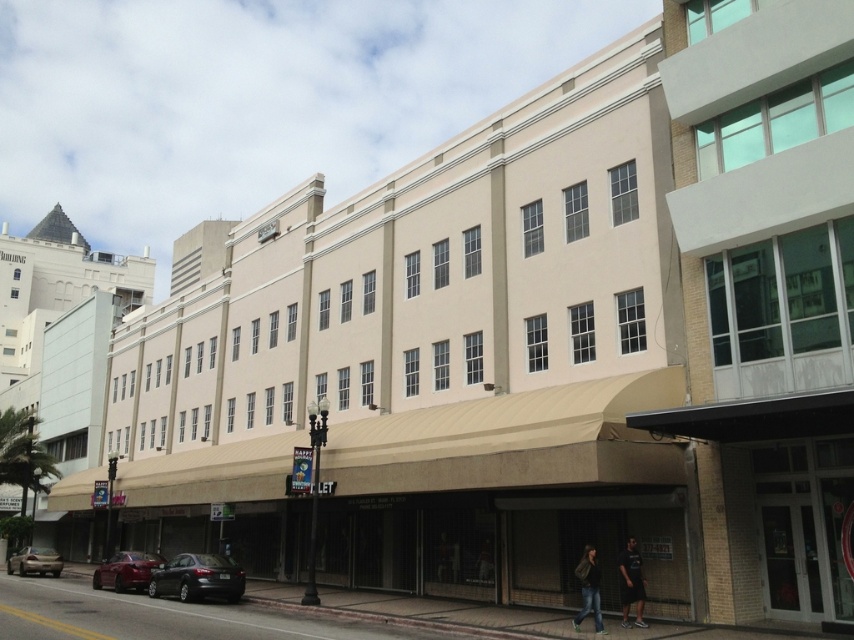
Question: Which object is the closest to the matte silver sedan at lower left?

Choices:
 (A) dark gray t-shirt at lower right
 (B) green fabric jacket at lower center
 (C) shiny red sedan at lower left

Answer: (C)

Question: Does green fabric jacket at lower center appear over matte silver sedan at lower left?

Choices:
 (A) yes
 (B) no

Answer: (A)

Question: Considering the real-world distances, which object is closest to the green fabric jacket at lower center?

Choices:
 (A) dark gray t-shirt at lower right
 (B) shiny red sedan at lower left

Answer: (A)

Question: Is shiny black sedan at lower left positioned behind dark gray t-shirt at lower right?

Choices:
 (A) yes
 (B) no

Answer: (A)

Question: Does shiny red sedan at lower left have a smaller size compared to dark gray t-shirt at lower right?

Choices:
 (A) yes
 (B) no

Answer: (B)

Question: Which point appears closest to the camera in this image?

Choices:
 (A) (45, 564)
 (B) (642, 582)
 (C) (588, 580)

Answer: (C)